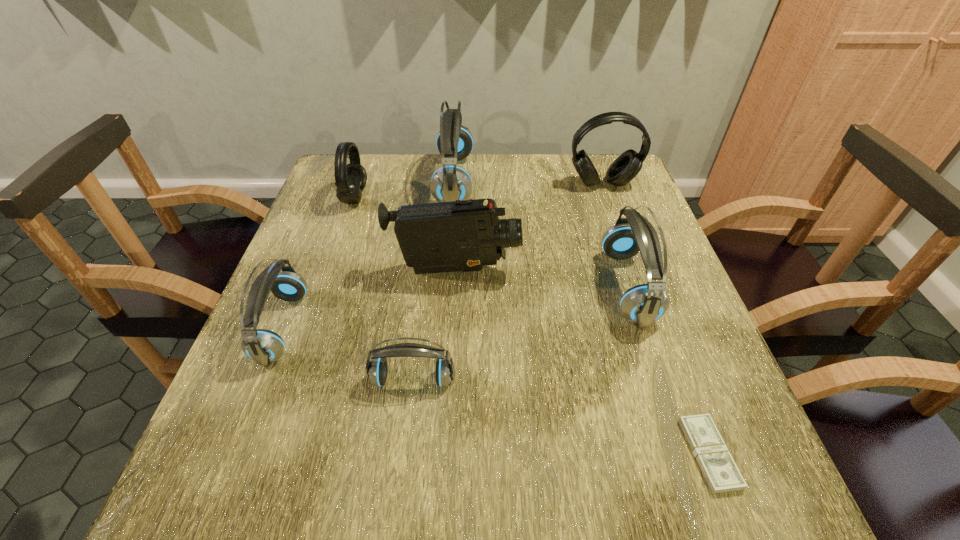
Select which object is the seventh closest to the second smallest blue headset. Please provide its 2D coordinates. Your answer should be formatted as a tuple, i.e. [(x, y)], where the tuple contains the x and y coordinates of a point satisfying the conditions above.

[(625, 167)]

Find the location of a particular element. the third closest headset to the second biggest blue headset is located at coordinates (377, 370).

Choose which headset is the third nearest neighbor to the nearest object. Please provide its 2D coordinates. Your answer should be formatted as a tuple, i.e. [(x, y)], where the tuple contains the x and y coordinates of a point satisfying the conditions above.

[(625, 167)]

Locate an element on the screen. The image size is (960, 540). the closest blue headset to the third biggest blue headset is located at coordinates pos(377,370).

What are the coordinates of `blue headset that is the closest to the leftmost blue headset` in the screenshot? It's located at (377, 370).

Locate an element on the screen. The height and width of the screenshot is (540, 960). vacant point that satisfies the following two spatial constraints: 1. on the earcups of the bigger gray headset; 2. on the front-facing side of the black camcorder is located at coordinates (633, 271).

Identify the location of free space that satisfies the following two spatial constraints: 1. on the front-facing side of the black camcorder; 2. on the back side of the money. The image size is (960, 540). (444, 454).

I want to click on vacant region that satisfies the following two spatial constraints: 1. on the earcups of the nearest object; 2. on the right side of the smaller gray headset, so click(x=267, y=454).

This screenshot has height=540, width=960. What are the coordinates of `vacant space that satisfies the following two spatial constraints: 1. on the front-facing side of the black camcorder; 2. on the ear cups of the smallest blue headset` in the screenshot? It's located at (449, 380).

The height and width of the screenshot is (540, 960). What are the coordinates of `free location that satisfies the following two spatial constraints: 1. on the ear cups of the rightmost blue headset; 2. on the ear cups of the smallest blue headset` in the screenshot? It's located at (658, 380).